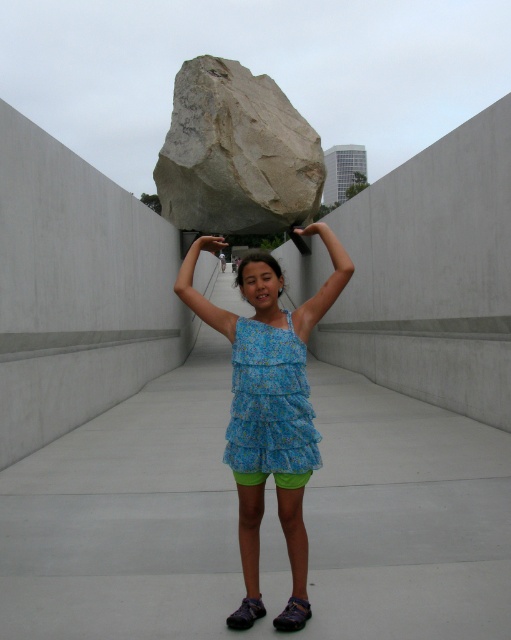
The girl in the blue floral dress at center is trying to balance the gray rough rock at center. Based on their positions, which object is positioned to the right of the other?

The gray rough rock at center is to the right of the blue floral dress at center according to the description.

The girl is trying to balance the gray rough rock at center on her head. Can she do it if the height of the matte blue dress at center reaches her shoulders?

The gray rough rock at center is not as tall as the matte blue dress at center. Since the dress reaches her shoulders, the rock is shorter than the dress, so it might not reach her head height. Therefore, she might not be able to balance the gray rough rock at center on her head.